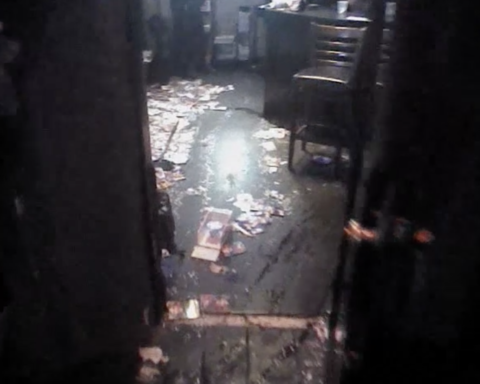
You are a GUI agent. You are given a task and a screenshot of the screen. Output one action in this format:
    pyautogui.click(x=<x>, y=<y>)
    Task: Click on the floor
    The image size is (480, 384).
    Given the screenshot: What is the action you would take?
    pyautogui.click(x=232, y=172)